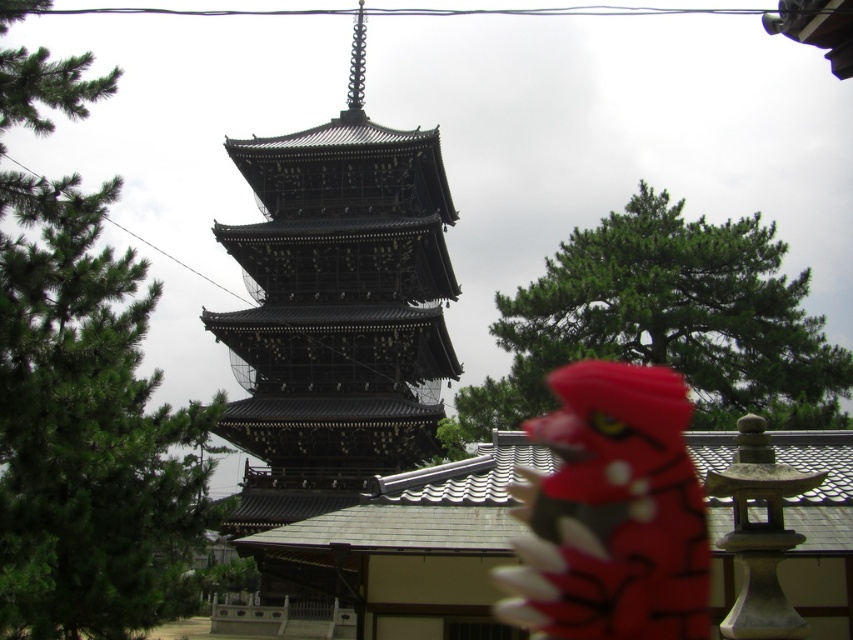
You are standing in front of the pagoda and see the point marked at coordinates [88,432]. Based on the scene description, can you determine what object this point is located on?

The point marked at coordinates [88,432] is located on the green matte tree at upper left.

You are standing at the base of the pagoda and want to take a photo of the point at coordinates point [366,257]. Your camera has a maximum focus range of 200 feet. Will the point be in focus?

The distance of point [366,257] from camera is 229.05 feet, which exceeds the camera maximum focus range of 200 feet. The point will not be in focus.

You are standing in front of the pagoda and want to take a photo. There are two points marked on the pagoda structure at coordinates point (430, 428) and point (706, 572). Which point is closer to your camera?

Point (430, 428) is further to the camera than point (706, 572), so the closer point to your camera is point (706, 572).